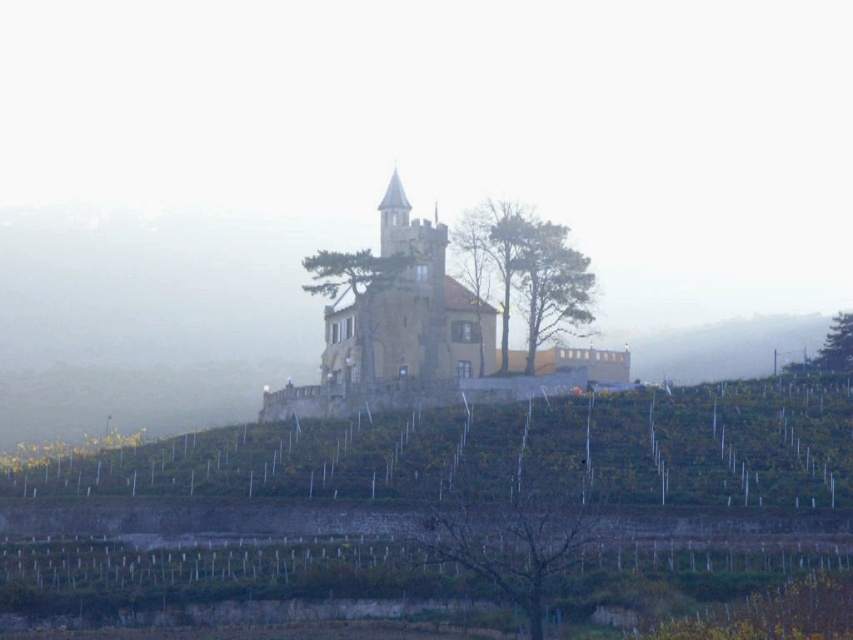
You are a tour guide leading a group to the brown stone church at center and the brown textured tree at center. The group wants to know which one is closer to the starting point. Can you determine this based on the scene?

The distance between the brown stone church at center and the brown textured tree at center is 37.09 meters, so it is impossible to determine which one is closer to the starting point without additional information about their positions relative to the starting point.

You are standing at the base of the hill looking up at the brown stone church at center and the green leafy tree at upper right. Which object is higher up the hill?

The brown stone church at center is positioned over the green leafy tree at upper right, so it is higher up the hill.

You are standing in front of the castle structure and notice two landmarks nearby. One is the brown stone church at center and the other is the brown textured tree at center. Which one is positioned to the left when facing the castle?

The brown stone church at center is to the left of the brown textured tree at center when facing the castle.